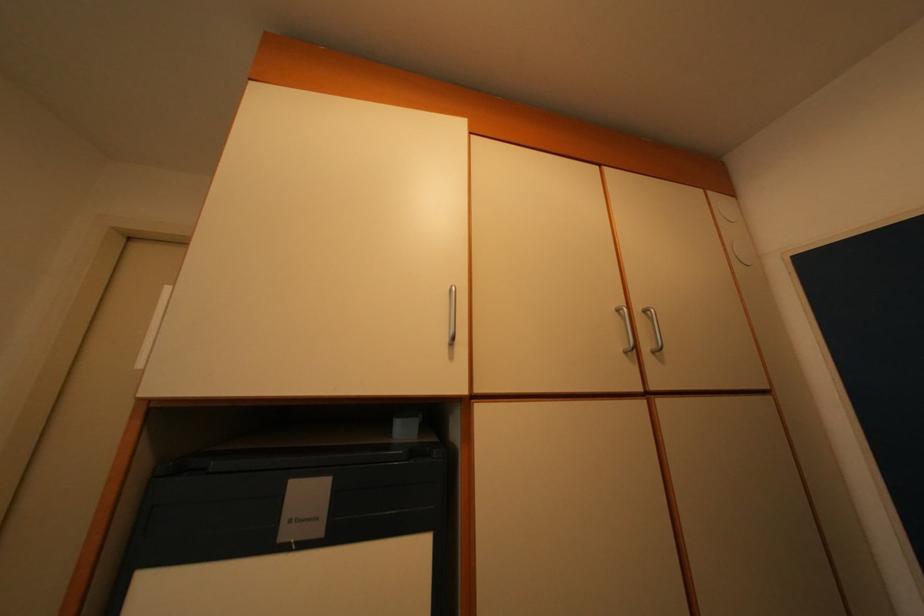
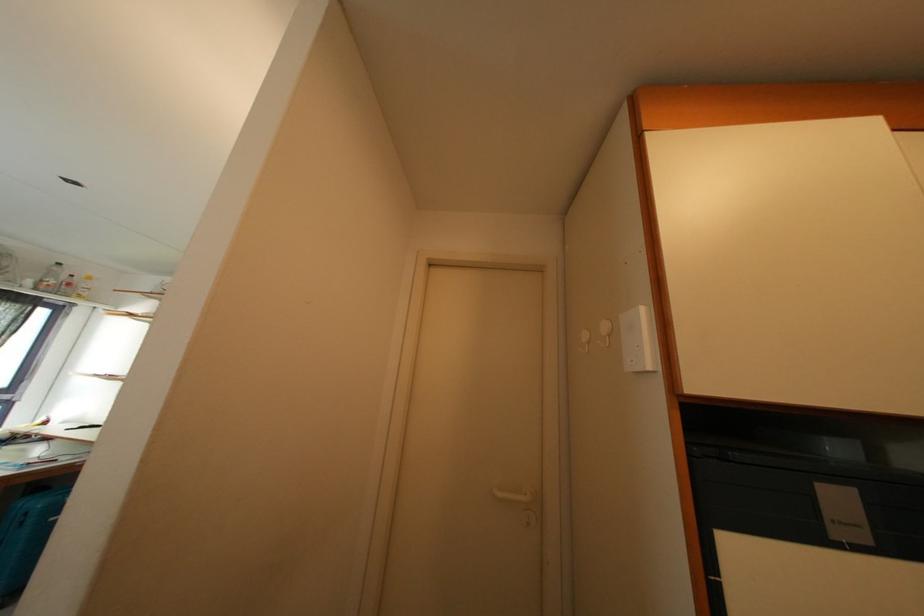
Question: Based on the continuous images, in which direction is the camera rotating? Reply with the corresponding letter.

Choices:
 (A) Left
 (B) Right
 (C) Up
 (D) Down

Answer: (A)